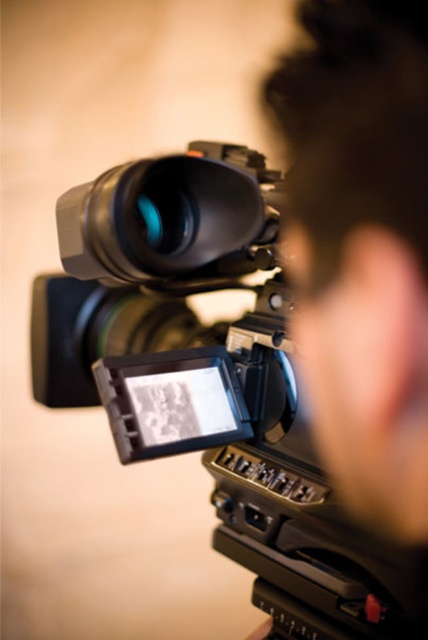
Which is in front, point (172, 454) or point (137, 275)?

Point (137, 275) is more forward.

Measure the distance between black plastic camera at center and camera.

black plastic camera at center and camera are 16.98 inches apart from each other.

This screenshot has height=640, width=428. Describe the element at coordinates (211, 380) in the screenshot. I see `black plastic camera at center` at that location.

Locate an element on the screen. The height and width of the screenshot is (640, 428). black plastic camera at center is located at coordinates (211, 380).